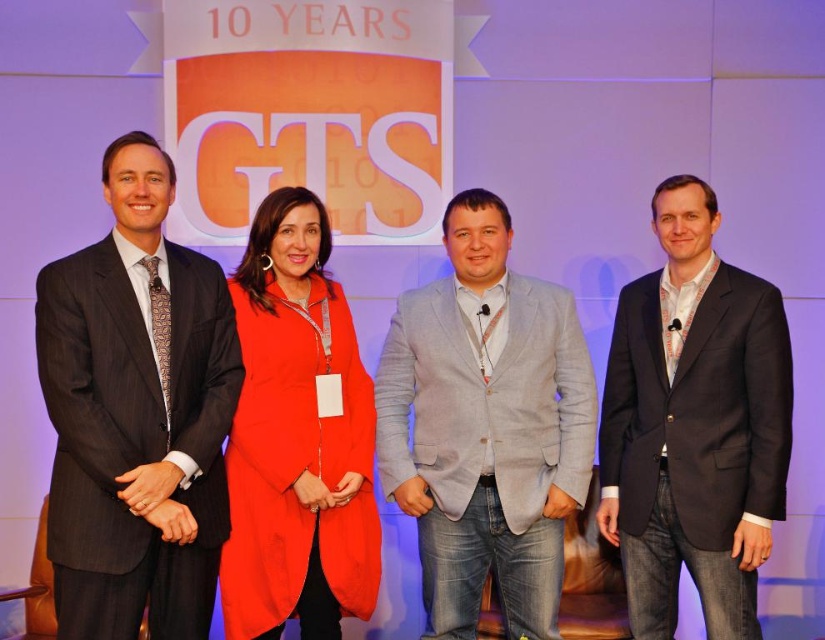
Is point (484, 538) positioned before point (755, 358)?

No, it is not.

Is gray linen blazer at center smaller than dark gray suit at right?

Indeed, gray linen blazer at center has a smaller size compared to dark gray suit at right.

You are a GUI agent. You are given a task and a screenshot of the screen. Output one action in this format:
    pyautogui.click(x=<x>, y=<y>)
    Task: Click on the gray linen blazer at center
    This screenshot has height=640, width=825.
    Given the screenshot: What is the action you would take?
    pyautogui.click(x=486, y=426)

I want to click on dark gray pinstripe suit at left, so click(135, 413).

Is dark gray pinstripe suit at left bigger than gray linen blazer at center?

Actually, dark gray pinstripe suit at left might be smaller than gray linen blazer at center.

At what (x,y) coordinates should I click in order to perform the action: click on dark gray pinstripe suit at left. Please return your answer as a coordinate pair (x, y). Looking at the image, I should click on (135, 413).

Is the position of dark gray pinstripe suit at left less distant than that of dark gray suit at right?

Yes, it is in front of dark gray suit at right.

Does dark gray pinstripe suit at left have a greater width compared to dark gray suit at right?

In fact, dark gray pinstripe suit at left might be narrower than dark gray suit at right.

Which is in front, point (120, 608) or point (769, 300)?

Point (120, 608) is more forward.

Find the location of a particular element. The image size is (825, 640). dark gray pinstripe suit at left is located at coordinates (135, 413).